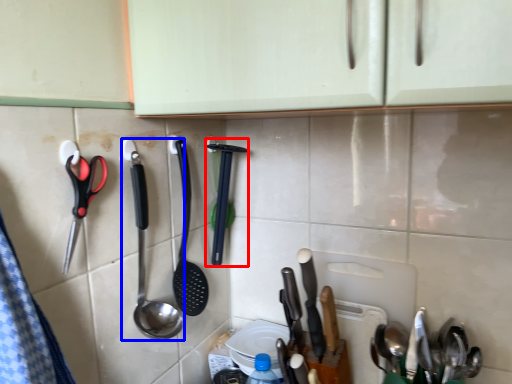
Question: Which object appears farthest to the camera in this image, spatula (highlighted by a red box) or spoon (highlighted by a blue box)?

Choices:
 (A) spatula
 (B) spoon

Answer: (A)